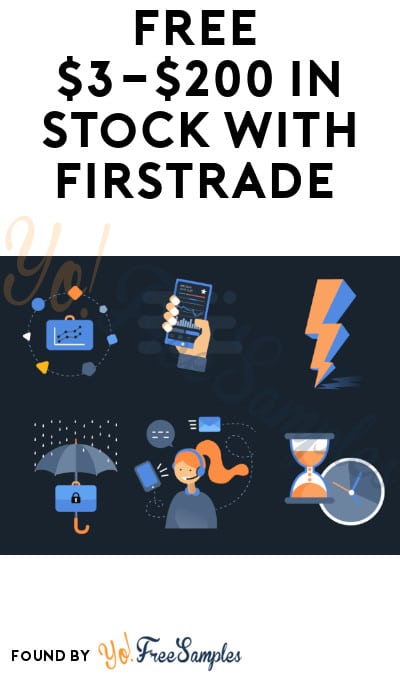
Where is `hourglass`? This screenshot has height=675, width=400. hourglass is located at coordinates (310, 455).